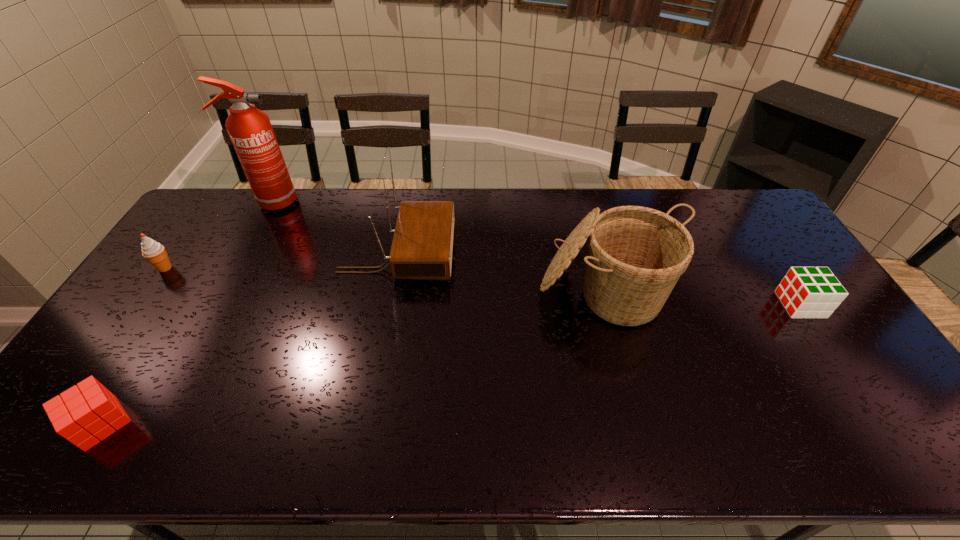
This screenshot has height=540, width=960. Find the location of `vacant space that satisfies the following two spatial constraints: 1. at the nozzle of the farthest object; 2. on the front side of the nearer cube`. vacant space that satisfies the following two spatial constraints: 1. at the nozzle of the farthest object; 2. on the front side of the nearer cube is located at coordinates (151, 423).